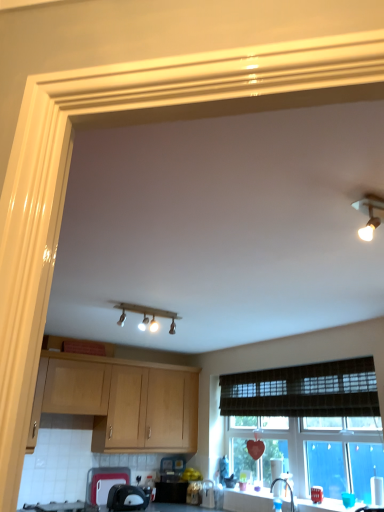
Question: From a real-world perspective, is matte wood light fixture at upper center under black plastic toaster at lower center, which is counted as the third appliance, starting from the right?

Choices:
 (A) yes
 (B) no

Answer: (B)

Question: Is matte wood light fixture at upper center looking in the opposite direction of black plastic toaster at lower center, the second appliance in the left-to-right sequence?

Choices:
 (A) yes
 (B) no

Answer: (B)

Question: Considering the relative sizes of matte wood light fixture at upper center and black plastic toaster at lower center, which is counted as the third appliance, starting from the right, in the image provided, is matte wood light fixture at upper center taller than black plastic toaster at lower center, which is counted as the third appliance, starting from the right,?

Choices:
 (A) yes
 (B) no

Answer: (B)

Question: Is matte wood light fixture at upper center bigger than black plastic toaster at lower center, which is counted as the third appliance, starting from the right?

Choices:
 (A) no
 (B) yes

Answer: (B)

Question: Is black plastic toaster at lower center, which is counted as the third appliance, starting from the right, a part of matte wood light fixture at upper center?

Choices:
 (A) yes
 (B) no

Answer: (B)

Question: Based on their positions, is white glossy countertop at lower center located to the left or right of matte plastic cutting board at lower left, which is the first appliance from left to right?

Choices:
 (A) right
 (B) left

Answer: (A)

Question: From a real-world perspective, is white glossy countertop at lower center above or below matte plastic cutting board at lower left, which is the first appliance from left to right?

Choices:
 (A) below
 (B) above

Answer: (B)

Question: Is white glossy countertop at lower center inside or outside of matte plastic cutting board at lower left, which is the first appliance from left to right?

Choices:
 (A) outside
 (B) inside

Answer: (A)

Question: Is white glossy countertop at lower center wider or thinner than matte plastic cutting board at lower left, acting as the fourth appliance starting from the right?

Choices:
 (A) wide
 (B) thin

Answer: (A)

Question: From their relative heights in the image, would you say metallic silver toaster at lower center, the 3th appliance viewed from the left, is taller or shorter than white glossy countertop at lower center?

Choices:
 (A) short
 (B) tall

Answer: (B)

Question: Would you say metallic silver toaster at lower center, which is the 2th appliance from right to left, is inside or outside white glossy countertop at lower center?

Choices:
 (A) inside
 (B) outside

Answer: (B)

Question: Considering the positions of metallic silver toaster at lower center, the 3th appliance viewed from the left, and white glossy countertop at lower center in the image, is metallic silver toaster at lower center, the 3th appliance viewed from the left, bigger or smaller than white glossy countertop at lower center?

Choices:
 (A) big
 (B) small

Answer: (A)

Question: Is metallic silver toaster at lower center, which is the 2th appliance from right to left, in front of or behind white glossy countertop at lower center in the image?

Choices:
 (A) behind
 (B) front

Answer: (A)

Question: From a real-world perspective, relative to metallic silver toaster at lower center, the 3th appliance viewed from the left, is black plastic toaster at lower center, which is counted as the third appliance, starting from the right, vertically above or below?

Choices:
 (A) above
 (B) below

Answer: (B)

Question: Considering their positions, is black plastic toaster at lower center, the second appliance in the left-to-right sequence, located in front of or behind metallic silver toaster at lower center, the 3th appliance viewed from the left?

Choices:
 (A) behind
 (B) front

Answer: (B)